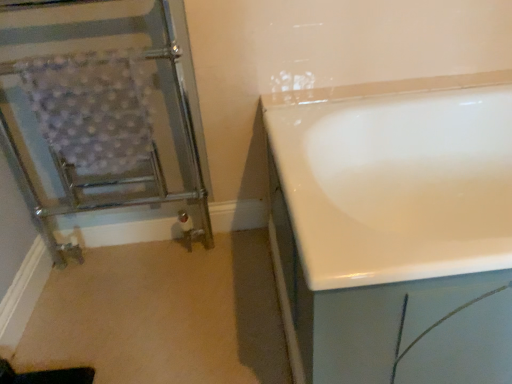
Question: In the image, is chrome metallic towel rack at left positioned in front of or behind white glossy bathtub at right?

Choices:
 (A) front
 (B) behind

Answer: (B)

Question: From the image's perspective, is chrome metallic towel rack at left positioned above or below white glossy bathtub at right?

Choices:
 (A) below
 (B) above

Answer: (B)

Question: From a real-world perspective, is chrome metallic towel rack at left positioned above or below white glossy bathtub at right?

Choices:
 (A) above
 (B) below

Answer: (A)

Question: From the image's perspective, is white glossy bathtub at right above or below chrome metallic towel rack at left?

Choices:
 (A) above
 (B) below

Answer: (B)

Question: Is white glossy bathtub at right inside the boundaries of chrome metallic towel rack at left, or outside?

Choices:
 (A) inside
 (B) outside

Answer: (B)

Question: Visually, is white glossy bathtub at right positioned to the left or to the right of chrome metallic towel rack at left?

Choices:
 (A) left
 (B) right

Answer: (B)

Question: Is point (423, 142) positioned closer to the camera than point (173, 193)?

Choices:
 (A) closer
 (B) farther

Answer: (A)